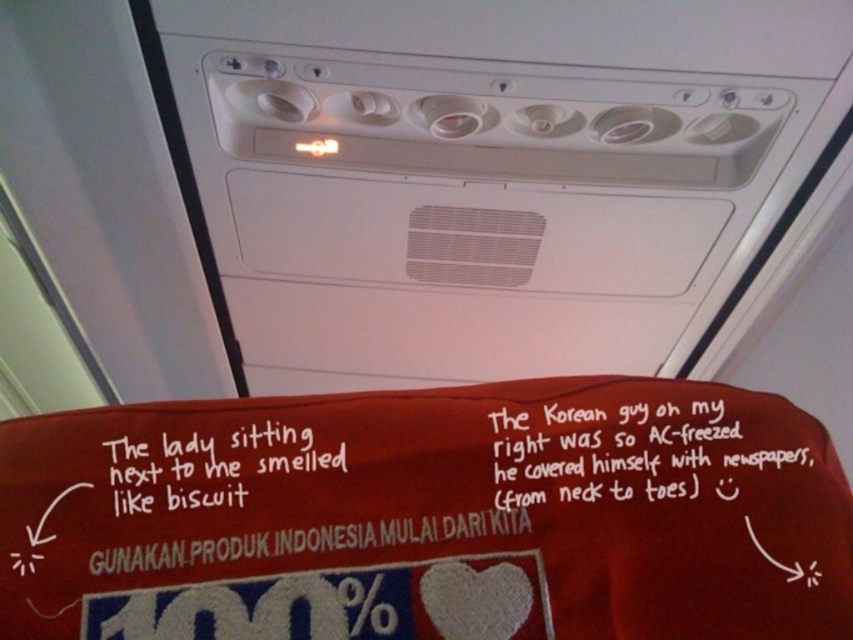
Question: Can you confirm if white paper at upper center is positioned to the left of white handwritten text at center?

Choices:
 (A) yes
 (B) no

Answer: (B)

Question: Which is farther from the white plastic air vent at upper center?

Choices:
 (A) white paper at upper center
 (B) white handwritten text at center

Answer: (B)

Question: Does white paper at upper center appear over white handwritten text at center?

Choices:
 (A) yes
 (B) no

Answer: (A)

Question: Which object is farther from the camera taking this photo?

Choices:
 (A) white handwritten text at center
 (B) white plastic air vent at upper center

Answer: (B)

Question: Which point is closer to the camera?

Choices:
 (A) pos(555,353)
 (B) pos(676,429)
 (C) pos(132,472)

Answer: (C)

Question: Considering the relative positions of white plastic air vent at upper center and white handwritten text at center in the image provided, where is white plastic air vent at upper center located with respect to white handwritten text at center?

Choices:
 (A) above
 (B) below

Answer: (A)